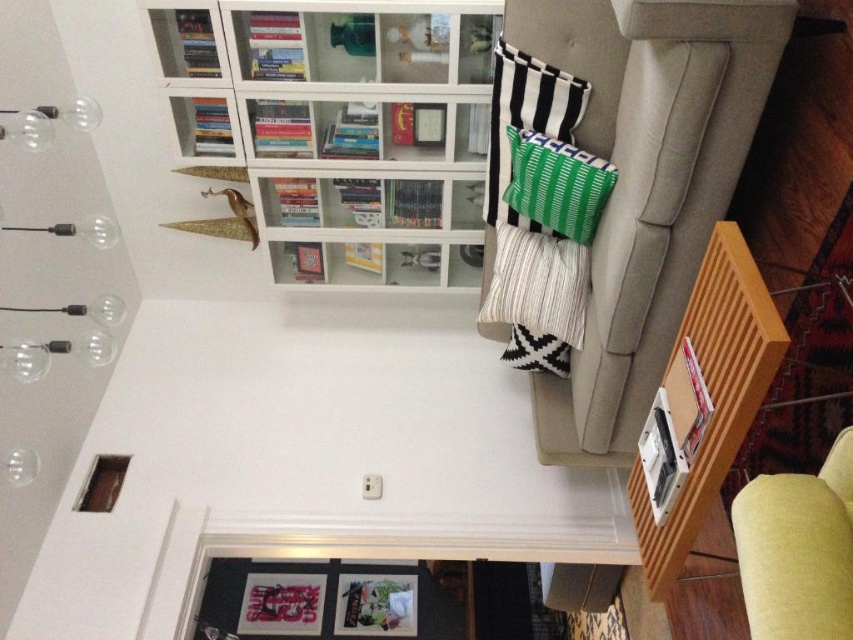
Is white glass bookshelf at upper left above beige fabric couch at right?

Indeed, white glass bookshelf at upper left is positioned over beige fabric couch at right.

Who is lower down, white glass bookshelf at upper left or beige fabric couch at right?

beige fabric couch at right

Does point (277, 1) come in front of point (489, 272)?

Yes, point (277, 1) is closer to viewer.

Where is `white glass bookshelf at upper left`? This screenshot has width=853, height=640. white glass bookshelf at upper left is located at coordinates (341, 125).

Is point (344, 216) positioned after point (554, 204)?

Yes, point (344, 216) is farther from viewer.

Does white glass bookshelf at upper left appear on the right side of green striped pillow at upper right?

Incorrect, white glass bookshelf at upper left is not on the right side of green striped pillow at upper right.

Is point (427, 200) farther from viewer compared to point (579, 205)?

Yes, point (427, 200) is behind point (579, 205).

Locate an element on the screen. Image resolution: width=853 pixels, height=640 pixels. white glass bookshelf at upper left is located at coordinates (341, 125).

Does white glass bookshelf at upper left appear over light yellow fabric armchair at lower right?

Yes.

Who is positioned more to the right, white glass bookshelf at upper left or light yellow fabric armchair at lower right?

light yellow fabric armchair at lower right

This screenshot has width=853, height=640. Identify the location of white glass bookshelf at upper left. (341, 125).